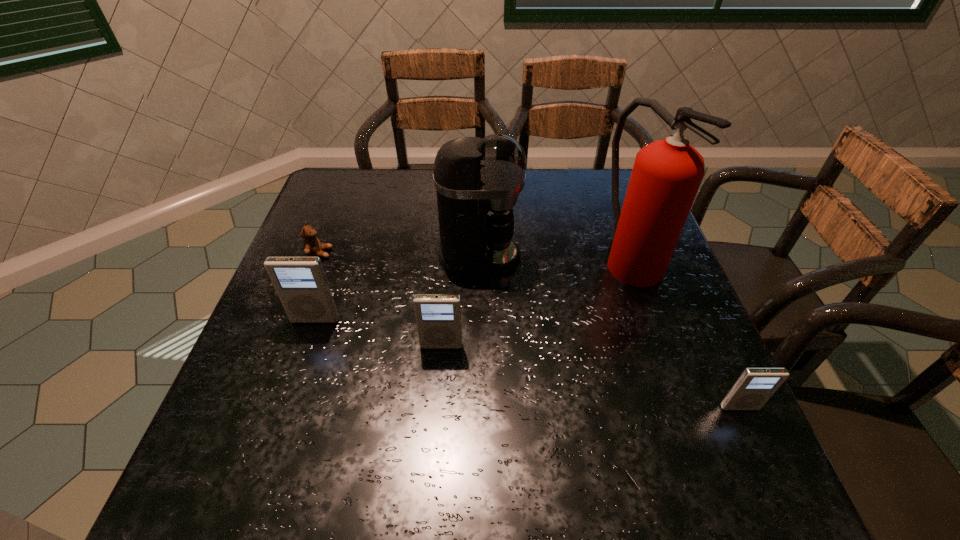
Where is `the leftmost iPod`? This screenshot has height=540, width=960. the leftmost iPod is located at coordinates (301, 284).

Find the location of a particular element. The width and height of the screenshot is (960, 540). the farthest iPod is located at coordinates (301, 284).

The width and height of the screenshot is (960, 540). I want to click on the third shortest object, so click(438, 316).

The height and width of the screenshot is (540, 960). Find the location of `the second iPod from left to right`. the second iPod from left to right is located at coordinates point(438,316).

Identify the location of the shortest iPod. (755, 386).

Locate an element on the screen. the rightmost iPod is located at coordinates (755, 386).

Find the location of a particular element. the tallest object is located at coordinates (666, 176).

Locate an element on the screen. the fifth shortest object is located at coordinates (478, 181).

Find the location of `teddy bear`. teddy bear is located at coordinates (312, 247).

Locate an element on the screen. The width and height of the screenshot is (960, 540). vacant area located on the front-facing side of the leftmost iPod is located at coordinates (300, 363).